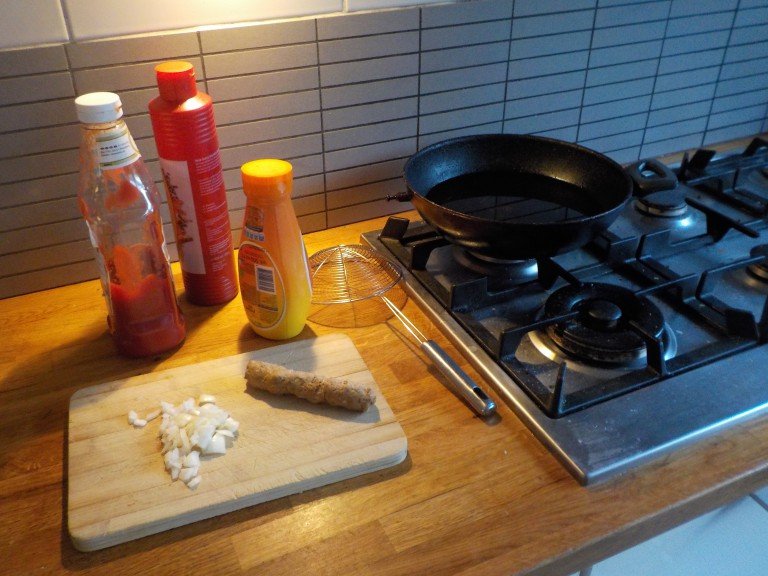
Locate an element on the screen. This screenshot has width=768, height=576. cutting board is located at coordinates (305, 454).